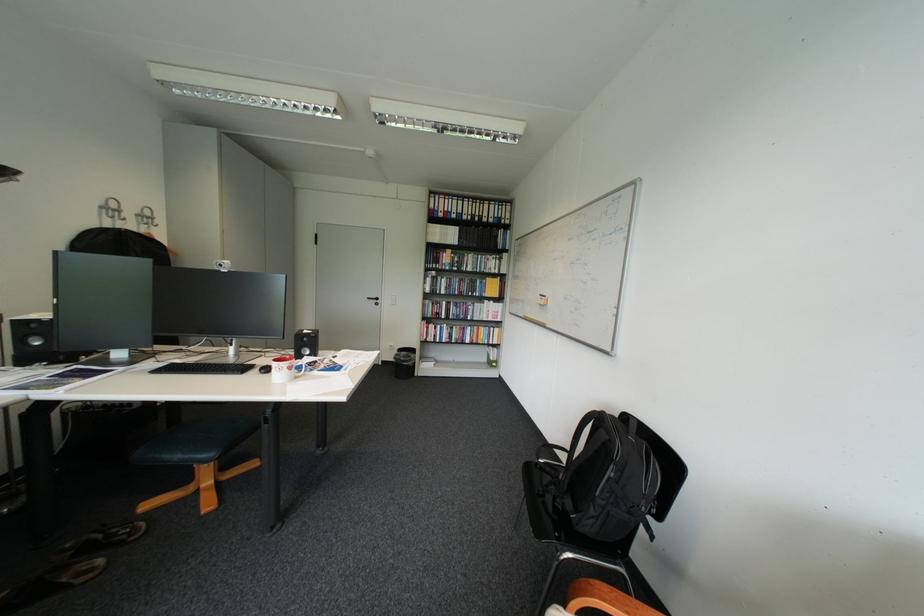
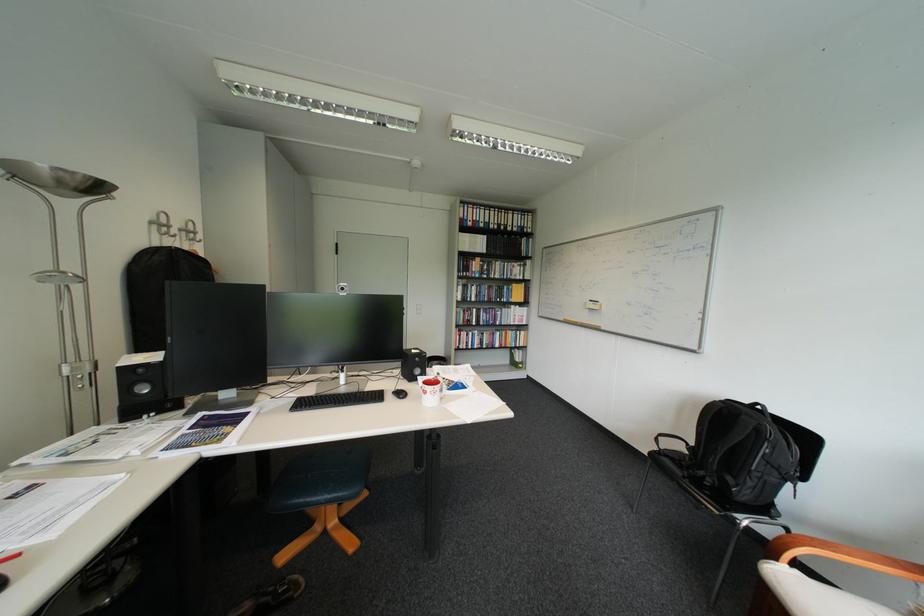
Where in the second image is the point corresponding to pixel 110 227 from the first image?

(160, 246)